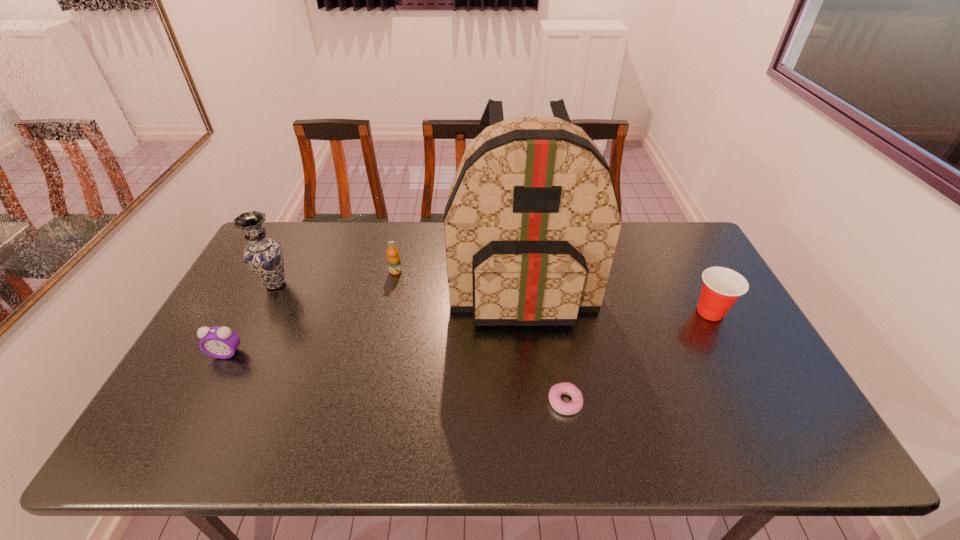
Locate an element on the screen. The width and height of the screenshot is (960, 540). vacant region located 0.180m on the front of the rightmost object is located at coordinates (747, 380).

Find the location of a particular element. This screenshot has height=540, width=960. free space located on the label of the orange juice is located at coordinates (380, 343).

Identify the location of vacant space situated on the face of the second shortest object. The width and height of the screenshot is (960, 540). (205, 392).

Where is `vacant space located 0.220m on the right of the nearest object`? vacant space located 0.220m on the right of the nearest object is located at coordinates (672, 402).

Locate an element on the screen. object at the far edge is located at coordinates (532, 220).

Find the location of a particular element. vase positioned at the left edge is located at coordinates [263, 256].

This screenshot has height=540, width=960. Identify the location of alarm clock that is at the left edge. (219, 342).

The width and height of the screenshot is (960, 540). I want to click on object at the right edge, so click(722, 286).

This screenshot has height=540, width=960. What are the coordinates of `free space at the far edge of the desktop` in the screenshot? It's located at (394, 231).

Identify the location of vacant space at the near edge of the desktop. The width and height of the screenshot is (960, 540). (231, 427).